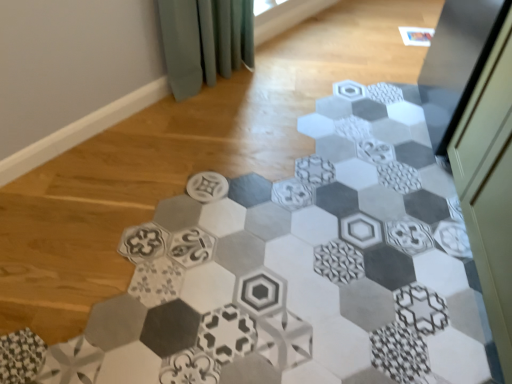
The width and height of the screenshot is (512, 384). What are the coordinates of `vacant location below white glossy picture frame at upper right (from a real-world perspective)` in the screenshot? It's located at (422, 38).